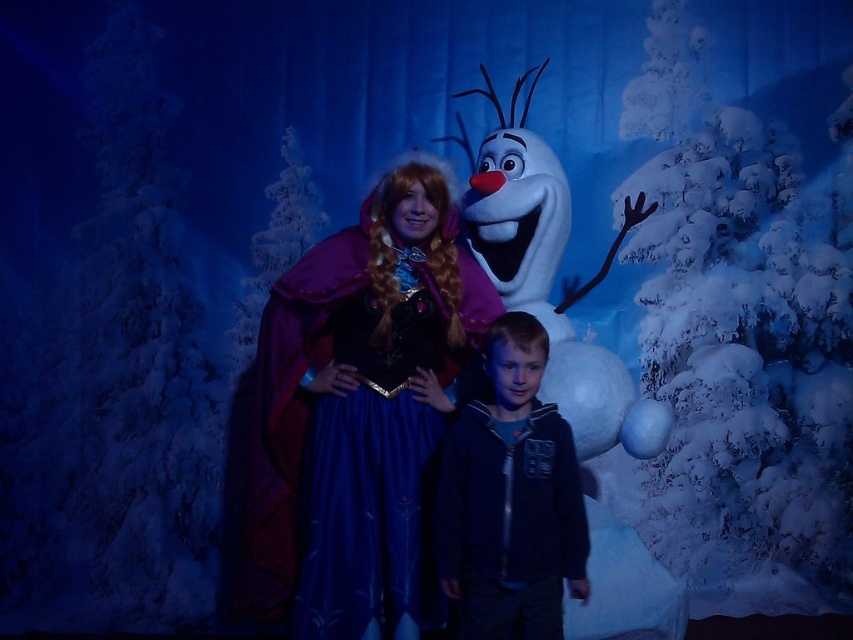
Can you confirm if velvet blue dress at center is taller than dark blue zip-up hoodie at center?

Yes, velvet blue dress at center is taller than dark blue zip-up hoodie at center.

Can you confirm if velvet blue dress at center is positioned below dark blue zip-up hoodie at center?

Actually, velvet blue dress at center is above dark blue zip-up hoodie at center.

Between point (323, 612) and point (521, 538), which one is positioned behind?

Point (323, 612)

Find the location of a particular element. Image resolution: width=853 pixels, height=640 pixels. velvet blue dress at center is located at coordinates (358, 412).

Who is more forward, (532, 196) or (515, 513)?

Point (515, 513) is in front.

Image resolution: width=853 pixels, height=640 pixels. Find the location of `white fluffy snowman at center`. white fluffy snowman at center is located at coordinates (550, 276).

Is point (328, 506) closer to viewer compared to point (512, 179)?

Yes.

Does velvet blue dress at center have a lesser height compared to white fluffy snowman at center?

Yes, velvet blue dress at center is shorter than white fluffy snowman at center.

Describe the element at coordinates (358, 412) in the screenshot. I see `velvet blue dress at center` at that location.

At what (x,y) coordinates should I click in order to perform the action: click on velvet blue dress at center. Please return your answer as a coordinate pair (x, y). The height and width of the screenshot is (640, 853). Looking at the image, I should click on (358, 412).